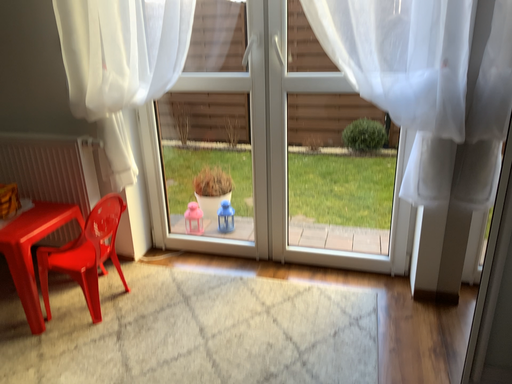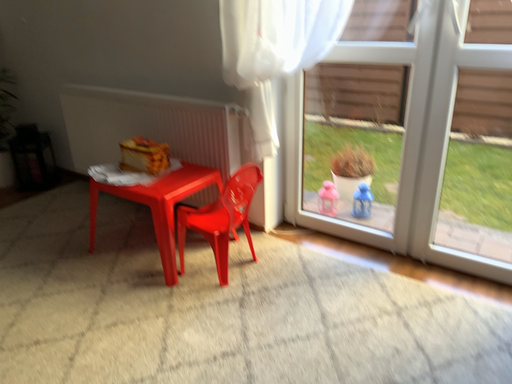
Question: Which way did the camera rotate in the video?

Choices:
 (A) rotated left
 (B) rotated right

Answer: (A)